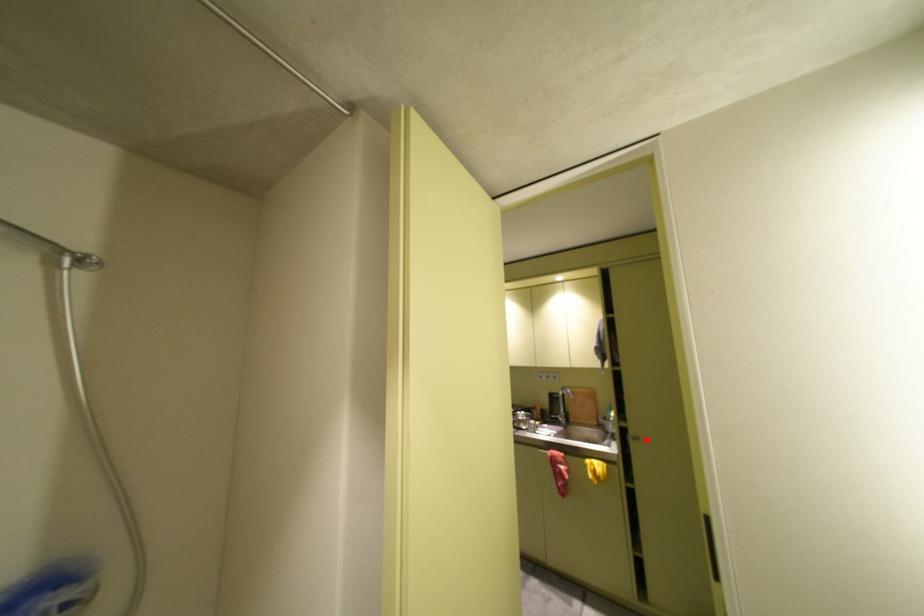
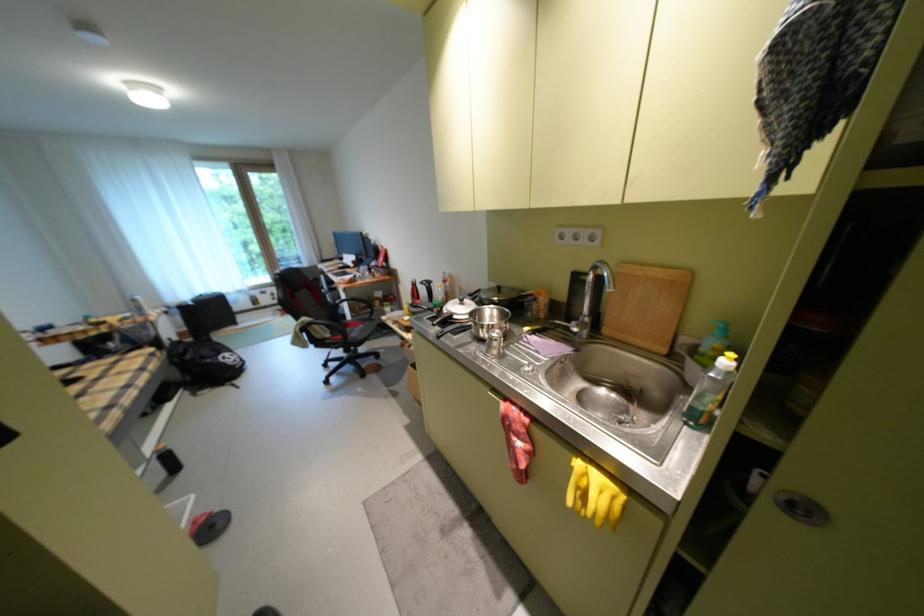
Find the pixel in the second image that matches the highlighted location in the first image.

(811, 511)